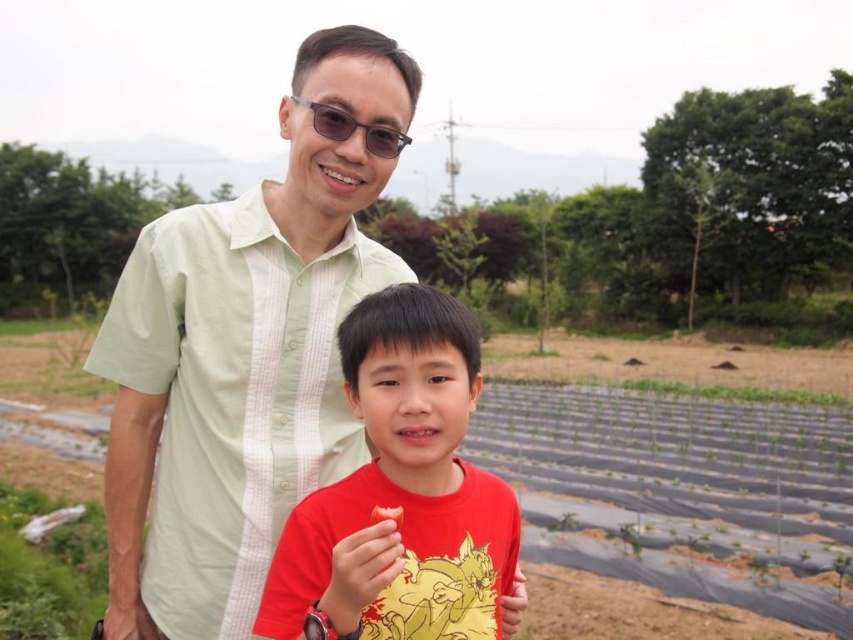
Question: Which point is closer to the camera?

Choices:
 (A) light green striped shirt at center
 (B) matte black sunglasses at upper center

Answer: (B)

Question: Can you confirm if red matte shirt at center is positioned to the left of matte black sunglasses at upper center?

Choices:
 (A) no
 (B) yes

Answer: (A)

Question: Can you confirm if light green striped shirt at center is positioned to the left of red matte shirt at center?

Choices:
 (A) no
 (B) yes

Answer: (B)

Question: Does light green striped shirt at center have a greater width compared to red matte shirt at center?

Choices:
 (A) yes
 (B) no

Answer: (A)

Question: Which of the following is the farthest from the observer?

Choices:
 (A) light green striped shirt at center
 (B) red matte shirt at center
 (C) matte black sunglasses at upper center

Answer: (A)

Question: Which is farther from the red matte shirt at center?

Choices:
 (A) light green striped shirt at center
 (B) matte black sunglasses at upper center

Answer: (B)